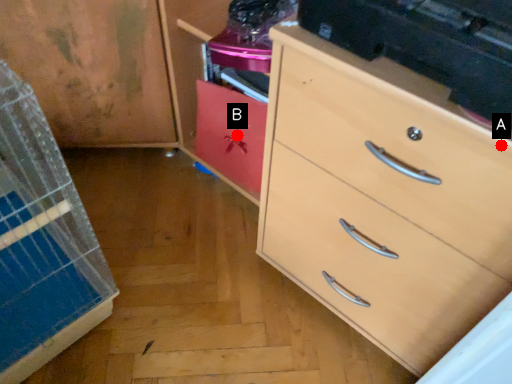
Question: Two points are circled on the image, labeled by A and B beside each circle. Which of the following is the closest to the observer?

Choices:
 (A) A is closer
 (B) B is closer

Answer: (A)